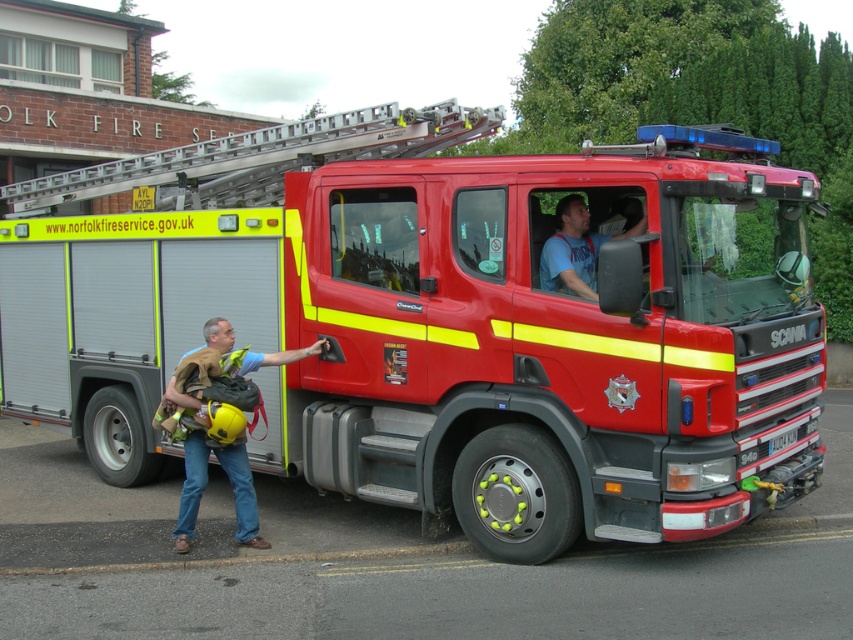
You are a pedestrian standing on the sidewalk and see the metallic red fire truck at center and the blue cotton shirt at center. Which object is closer to the street?

The metallic red fire truck at center is positioned on the right side of blue cotton shirt at center, so the metallic red fire truck at center is closer to the street than the blue cotton shirt at center.

In the scene shown: You are a firefighter trying to locate the ladder on the fire truck. Where exactly is the silver metallic ladder at upper center positioned in terms of coordinates?

The silver metallic ladder at upper center is positioned at coordinates (x=259, y=157).